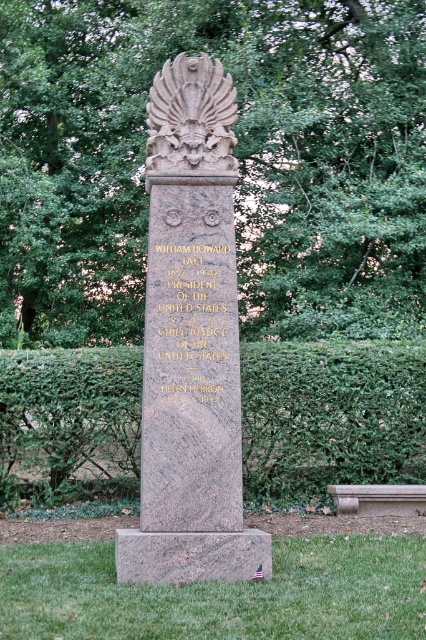
Question: Which point is closer to the camera taking this photo?

Choices:
 (A) (383, 508)
 (B) (261, 390)
 (C) (308, 36)
 (D) (198, 225)

Answer: (D)

Question: Can you confirm if polished granite monument at center is bigger than green leafy hedge at center?

Choices:
 (A) yes
 (B) no

Answer: (A)

Question: Based on their relative distances, which object is farther from the polished granite monument at center?

Choices:
 (A) green leafy tree at center
 (B) smooth gray stone bench at lower right

Answer: (A)

Question: Does polished granite monument at center appear under green leafy hedge at center?

Choices:
 (A) yes
 (B) no

Answer: (B)

Question: Which of the following is the closest to the observer?

Choices:
 (A) (411, 330)
 (B) (232, 92)
 (C) (357, 493)

Answer: (B)

Question: Observing the image, what is the correct spatial positioning of green leafy tree at center in reference to carved stone eagle at center?

Choices:
 (A) below
 (B) above

Answer: (B)